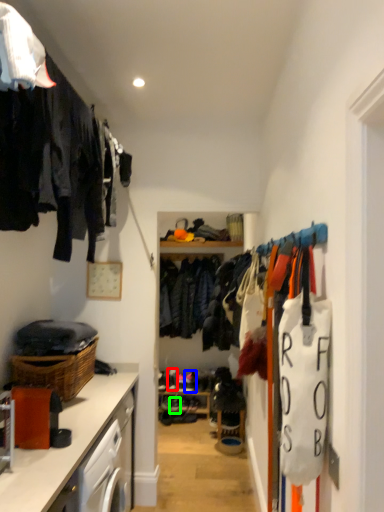
Question: Which is farther away from shoe (highlighted by a red box)? shoe (highlighted by a blue box) or shoe (highlighted by a green box)?

Choices:
 (A) shoe
 (B) shoe

Answer: (B)